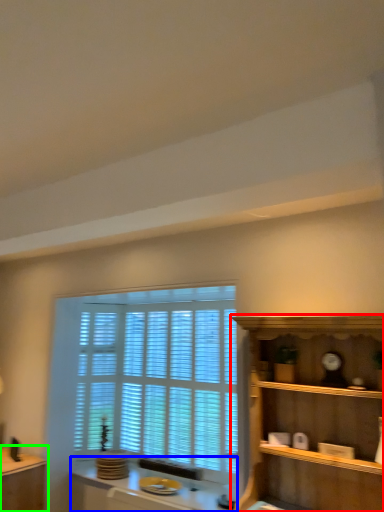
Question: Based on their relative distances, which object is farther from shelf (highlighted by a red box)? Choose from vanity (highlighted by a blue box) and table (highlighted by a green box).

Choices:
 (A) vanity
 (B) table

Answer: (B)